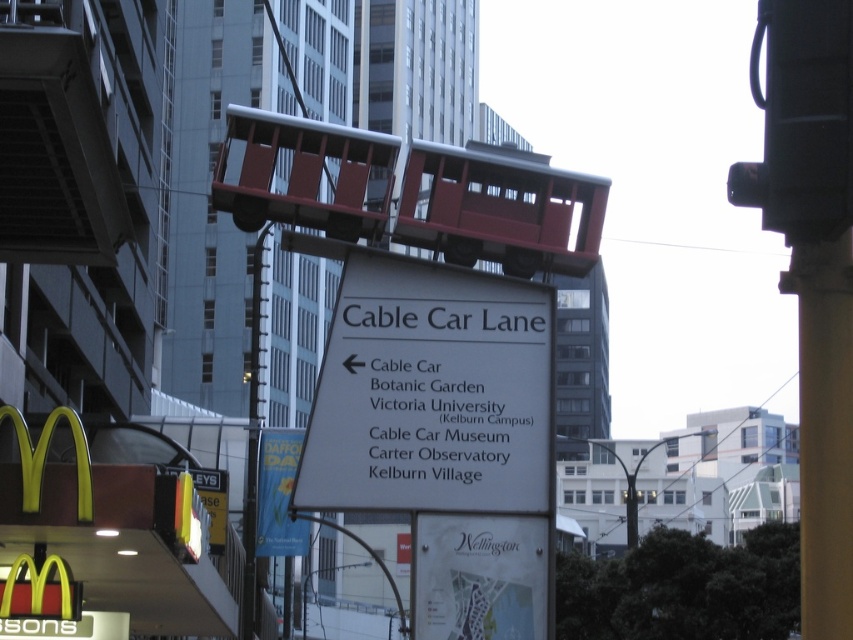
Question: Which of these objects is positioned farthest from the yellow plastic traffic light at lower left?

Choices:
 (A) metallic pole at center-left
 (B) white plastic sign at center
 (C) yellow paper sign at center
 (D) white paper map at center

Answer: (C)

Question: Which of the following is the farthest from the observer?

Choices:
 (A) metallic pole at center-left
 (B) yellow plastic traffic light at lower left
 (C) yellow paper sign at center
 (D) white plastic sign at center

Answer: (A)

Question: Is white plastic sign at center to the right of yellow plastic traffic light at lower left from the viewer's perspective?

Choices:
 (A) yes
 (B) no

Answer: (A)

Question: Does metallic pole at center-left appear on the left side of yellow plastic traffic light at lower left?

Choices:
 (A) yes
 (B) no

Answer: (A)

Question: Where is white plastic sign at center located in relation to white paper map at center in the image?

Choices:
 (A) right
 (B) left

Answer: (B)

Question: Which point is farther to the camera?

Choices:
 (A) (274, 456)
 (B) (254, 410)
 (C) (451, 602)

Answer: (B)